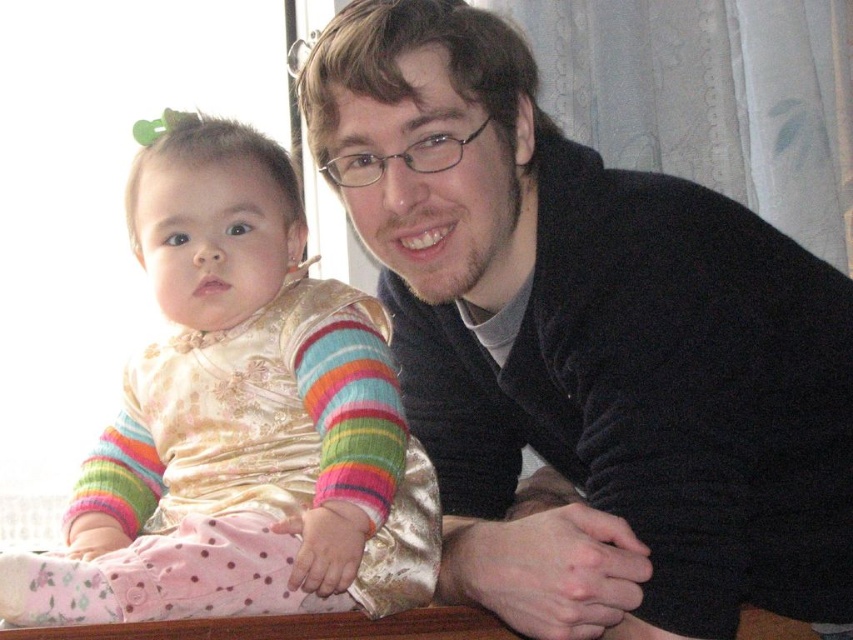
Consider the image. Who is higher up, black velvet sweater at upper right or silky gold dress at left?

black velvet sweater at upper right is higher up.

Does black velvet sweater at upper right have a lesser height compared to silky gold dress at left?

No, black velvet sweater at upper right is not shorter than silky gold dress at left.

At what (x,y) coordinates should I click in order to perform the action: click on black velvet sweater at upper right. Please return your answer as a coordinate pair (x, y). Looking at the image, I should click on (587, 346).